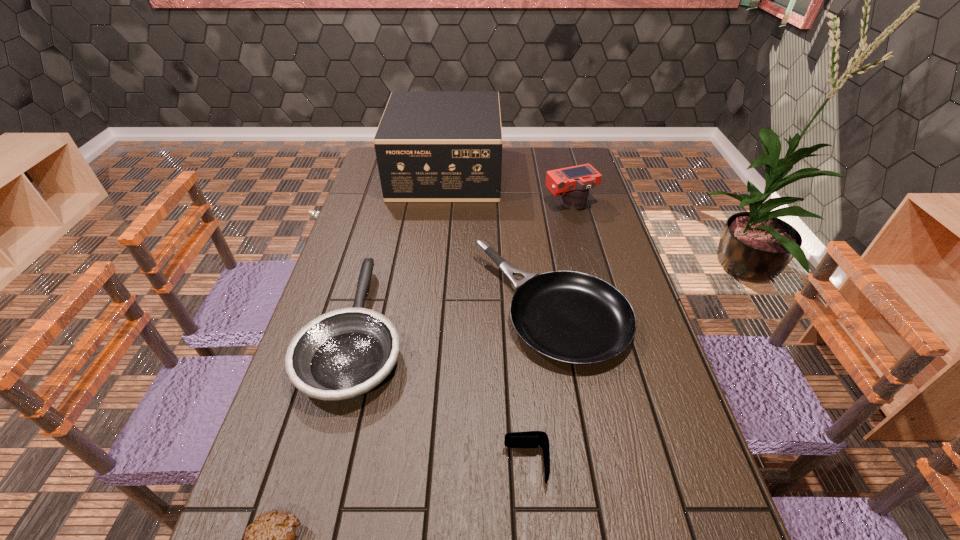
The height and width of the screenshot is (540, 960). Identify the location of free space located on the handle side of the frying pan. (379, 247).

Identify the location of vacant region located 0.140m on the outer surface of the wallet. Image resolution: width=960 pixels, height=540 pixels. (437, 464).

I want to click on vacant position located on the outer surface of the wallet, so click(x=476, y=464).

I want to click on free location located on the outer surface of the wallet, so click(x=331, y=464).

Locate an element on the screen. object that is positioned at the far edge is located at coordinates (431, 146).

Locate an element on the screen. This screenshot has height=540, width=960. box that is positioned at the left edge is located at coordinates (431, 146).

Locate an element on the screen. frying pan situated at the left edge is located at coordinates (341, 355).

The image size is (960, 540). Identify the location of camera that is at the right edge. (573, 183).

Locate an element on the screen. The image size is (960, 540). pan that is at the right edge is located at coordinates (571, 317).

The width and height of the screenshot is (960, 540). Find the location of `object positioned at the far left corner`. object positioned at the far left corner is located at coordinates (431, 146).